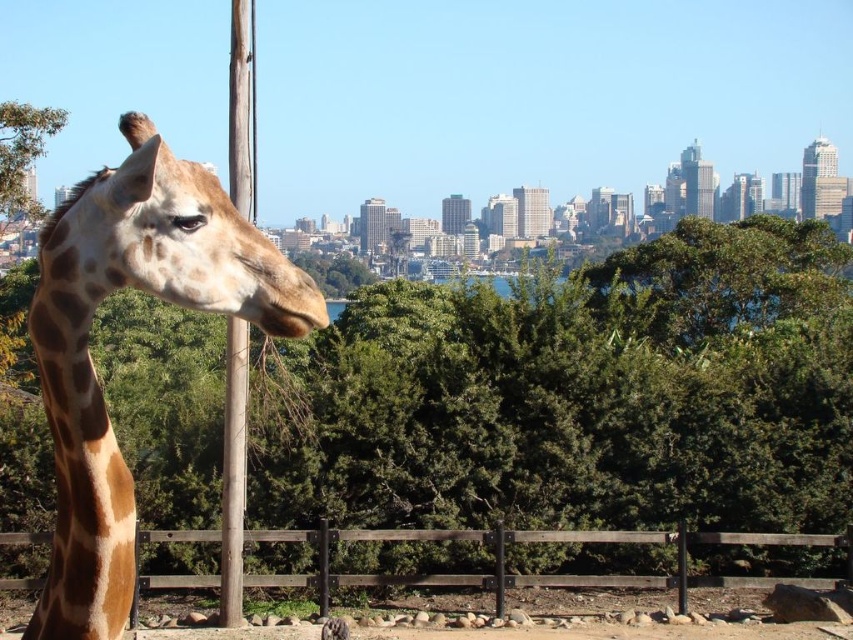
Question: From the image, what is the correct spatial relationship of green leafy tree at center in relation to brown wooden fence at lower center?

Choices:
 (A) right
 (B) left

Answer: (A)

Question: Which object is positioned farthest from the spotted fur giraffe at left?

Choices:
 (A) brown wooden fence at lower center
 (B) brown wood pole at left
 (C) green leafy tree at center

Answer: (A)

Question: Is spotted fur giraffe at left wider than brown wooden fence at lower center?

Choices:
 (A) yes
 (B) no

Answer: (B)

Question: Which object is farther from the camera taking this photo?

Choices:
 (A) spotted fur giraffe at left
 (B) brown wooden fence at lower center
 (C) brown wood pole at left
 (D) green leafy tree at center

Answer: (C)

Question: Can you confirm if green leafy tree at center is positioned to the right of spotted fur giraffe at left?

Choices:
 (A) no
 (B) yes

Answer: (B)

Question: Which is nearer to the brown wooden fence at lower center?

Choices:
 (A) spotted fur giraffe at left
 (B) green leafy tree at center
 (C) brown wood pole at left

Answer: (B)